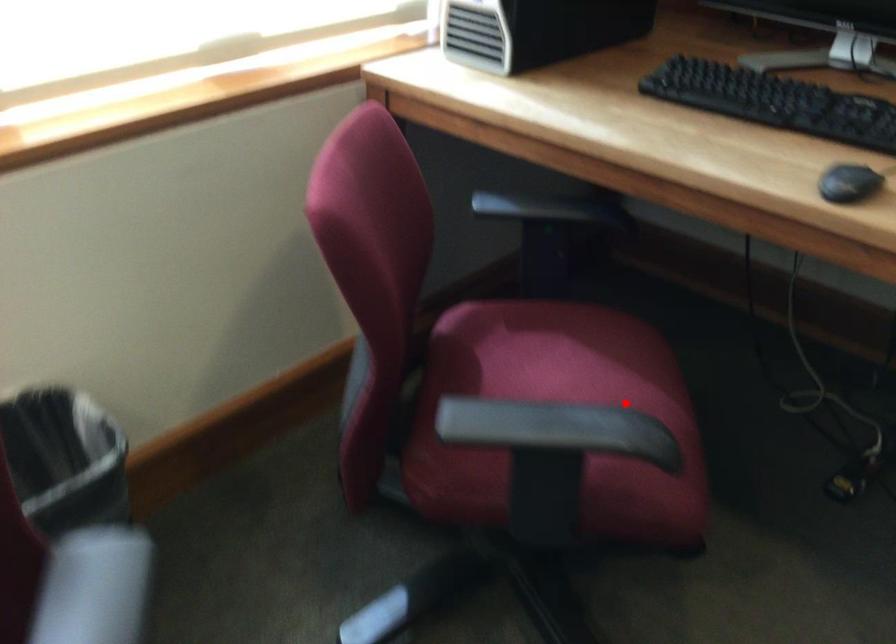
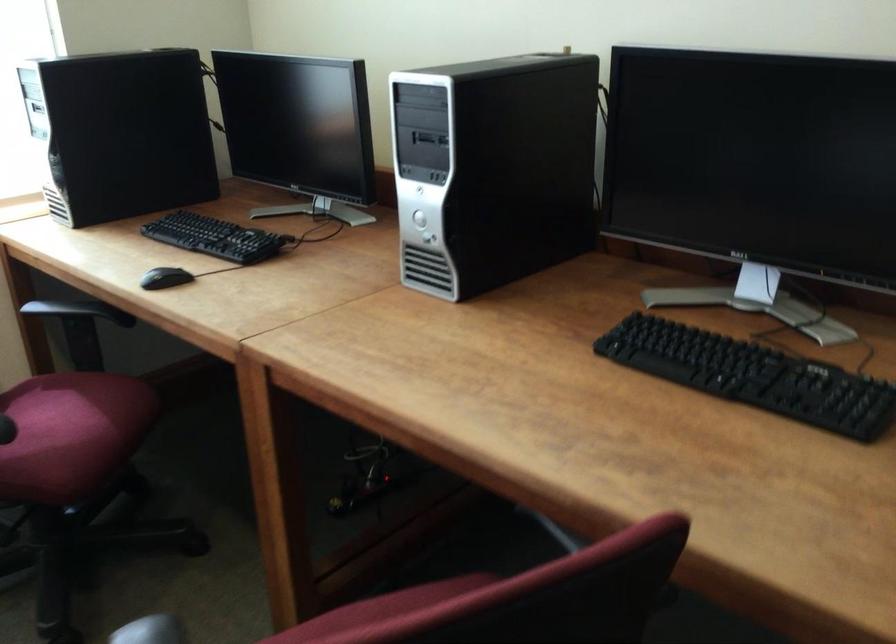
Find the pixel in the second image that matches the highlighted location in the first image.

(73, 428)